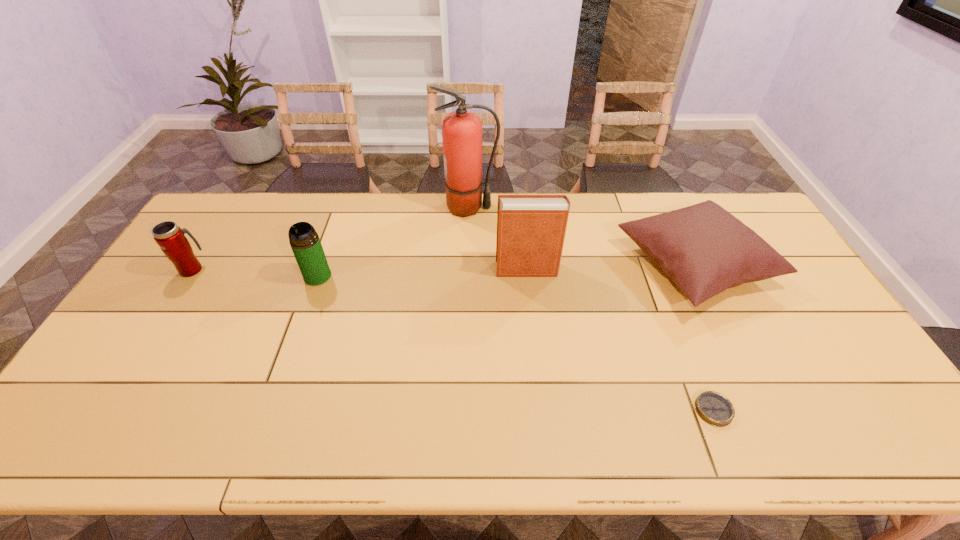
Locate an element on the screen. vacant space situated on the open cover of the hardback book is located at coordinates (468, 269).

Where is `vacant space located 0.180m on the open cover of the hardback book`? This screenshot has width=960, height=540. vacant space located 0.180m on the open cover of the hardback book is located at coordinates (439, 269).

Identify the location of free space located on the open cover of the hardback book. (448, 269).

Where is `vacant region located from the spout of the fifth object from right to left`? vacant region located from the spout of the fifth object from right to left is located at coordinates (296, 337).

You are a GUI agent. You are given a task and a screenshot of the screen. Output one action in this format:
    pyautogui.click(x=<x>, y=<y>)
    Task: Click on the free spot located on the side with the handle of the left thermos bottle
    Image resolution: width=960 pixels, height=540 pixels.
    Given the screenshot: What is the action you would take?
    pyautogui.click(x=231, y=208)

At what (x,y) coordinates should I click in order to perform the action: click on vacant space situated 0.060m on the side with the handle of the left thermos bottle. Please return your answer as a coordinate pair (x, y). The height and width of the screenshot is (540, 960). Looking at the image, I should click on (206, 247).

Find the location of `vacant space located on the side with the handle of the left thermos bottle`. vacant space located on the side with the handle of the left thermos bottle is located at coordinates (229, 212).

Locate an element on the screen. Image resolution: width=960 pixels, height=540 pixels. vacant space positioned on the left of the cushion is located at coordinates (532, 265).

At what (x,y) coordinates should I click in order to perform the action: click on blank area located 0.290m on the back of the shortest object. Please return your answer as a coordinate pair (x, y). Looking at the image, I should click on (672, 304).

Image resolution: width=960 pixels, height=540 pixels. In order to click on fire extinguisher located in the far edge section of the desktop in this screenshot , I will do `click(461, 130)`.